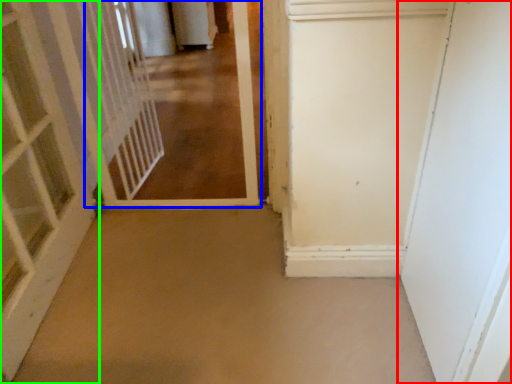
Question: Considering the real-world distances, which object is closest to door (highlighted by a red box)? corridor (highlighted by a blue box) or door (highlighted by a green box).

Choices:
 (A) corridor
 (B) door

Answer: (A)